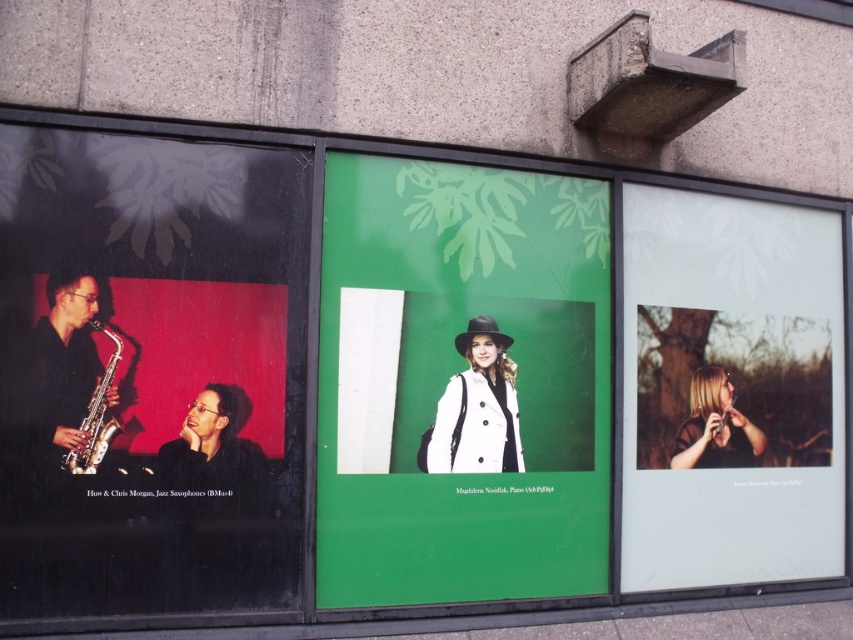
Question: Can you confirm if translucent glass portrait at right is thinner than blonde hair at center?

Choices:
 (A) no
 (B) yes

Answer: (A)

Question: Is translucent glass portrait at right closer to the viewer compared to white matte coat at center?

Choices:
 (A) no
 (B) yes

Answer: (A)

Question: Is green matte poster at center closer to camera compared to shiny silver saxophone at left?

Choices:
 (A) no
 (B) yes

Answer: (A)

Question: Among these points, which one is farthest from the camera?

Choices:
 (A) (454, 456)
 (B) (180, 403)
 (C) (728, 460)
 (D) (657, 541)

Answer: (C)

Question: Which is farther from the blonde hair at center?

Choices:
 (A) matte black saxophone at left
 (B) green matte poster at center
 (C) matte black jacket at center
 (D) translucent glass portrait at right

Answer: (A)

Question: Which object appears closest to the camera in this image?

Choices:
 (A) shiny gold saxophone at left
 (B) matte black saxophone at left

Answer: (B)